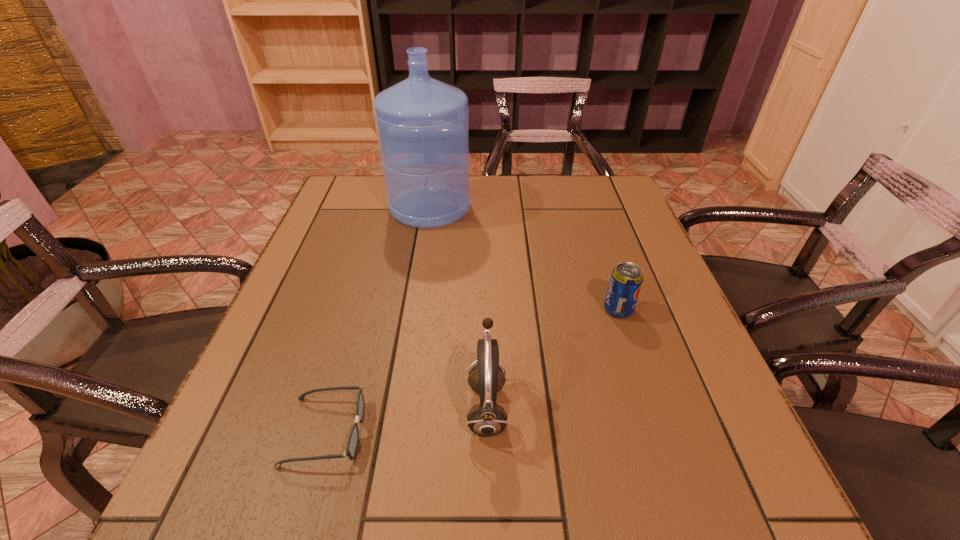
You are a GUI agent. You are given a task and a screenshot of the screen. Output one action in this format:
    pyautogui.click(x=<x>, y=<y>)
    Task: Click on the free space between the spectacles and the tallest object
    This screenshot has width=960, height=540.
    Given the screenshot: What is the action you would take?
    pyautogui.click(x=377, y=320)

Locate an element on the screen. The image size is (960, 540). empty space that is in between the second tallest object and the spectacles is located at coordinates (406, 419).

Find the location of a particular element. free spot between the earphone and the soda is located at coordinates (553, 359).

Choose which object is the third nearest neighbor to the rightmost object. Please provide its 2D coordinates. Your answer should be formatted as a tuple, i.e. [(x, y)], where the tuple contains the x and y coordinates of a point satisfying the conditions above.

[(352, 444)]

Point out which object is positioned as the third nearest to the shortest object. Please provide its 2D coordinates. Your answer should be formatted as a tuple, i.e. [(x, y)], where the tuple contains the x and y coordinates of a point satisfying the conditions above.

[(423, 124)]

Where is `vacant space that satisfies the following two spatial constraints: 1. on the front side of the third tallest object; 2. on the ear pads of the second tallest object`? The width and height of the screenshot is (960, 540). vacant space that satisfies the following two spatial constraints: 1. on the front side of the third tallest object; 2. on the ear pads of the second tallest object is located at coordinates (651, 407).